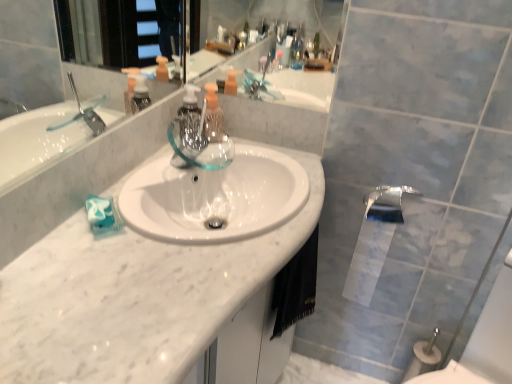
Identify the location of empty space that is ontop of white marble counter top at center (from a real-world perspective). (146, 254).